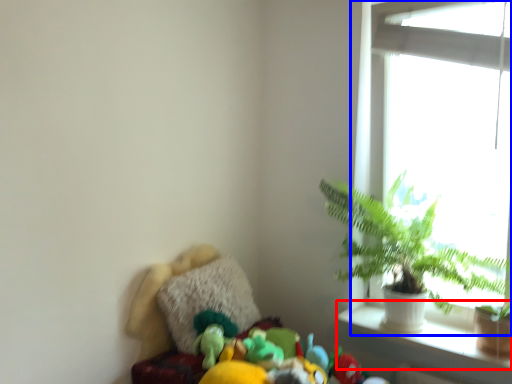
Question: Which object is further to the camera taking this photo, window sill (highlighted by a red box) or window (highlighted by a blue box)?

Choices:
 (A) window sill
 (B) window

Answer: (A)